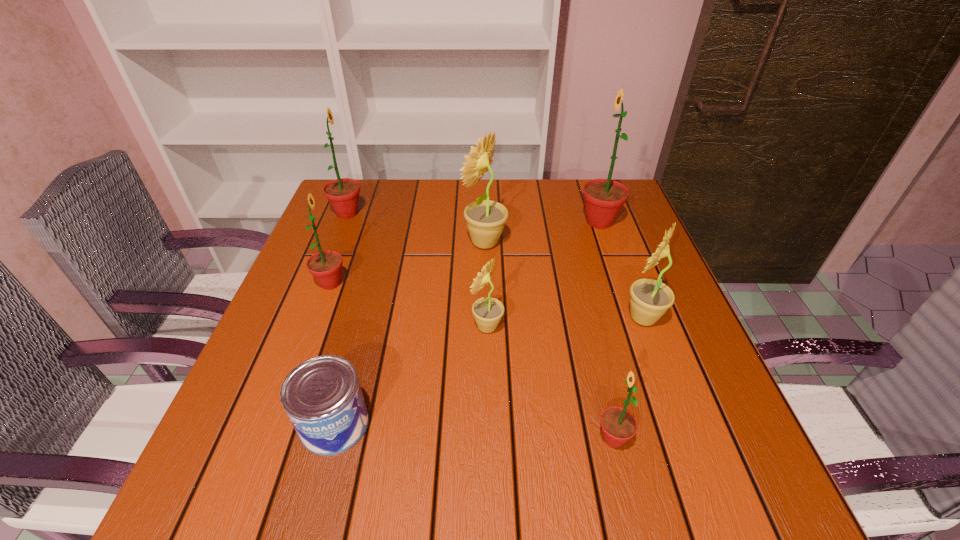
Where is `can that is at the left edge`? can that is at the left edge is located at coordinates (322, 396).

Locate an element on the screen. This screenshot has height=540, width=960. object present at the far left corner is located at coordinates (342, 193).

Where is `object positioned at the far right corner`? object positioned at the far right corner is located at coordinates point(603,198).

In the image, there is a desktop. Where is `vacant region at the far edge`? The width and height of the screenshot is (960, 540). vacant region at the far edge is located at coordinates (473, 195).

Find the location of a particular element. The height and width of the screenshot is (540, 960). blank space at the near edge is located at coordinates pos(540,480).

I want to click on vacant area at the right edge, so pos(653,420).

Locate an element on the screen. This screenshot has height=540, width=960. vacant area at the far left corner of the desktop is located at coordinates (368, 202).

Where is `free location at the near right corner`? This screenshot has width=960, height=540. free location at the near right corner is located at coordinates (701, 463).

Find the location of `vacant space in between the biggest green sunflower and the smallest yellow sunflower`. vacant space in between the biggest green sunflower and the smallest yellow sunflower is located at coordinates (543, 274).

This screenshot has width=960, height=540. I want to click on vacant area that lies between the second smallest yellow sunflower and the rightmost green sunflower, so click(621, 270).